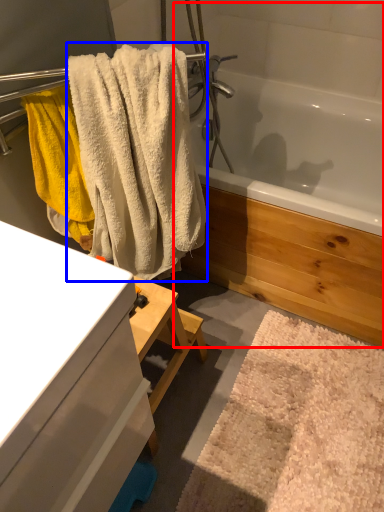
Question: Which of the following is the farthest to the observer, jacuzzi (highlighted by a red box) or towel (highlighted by a blue box)?

Choices:
 (A) jacuzzi
 (B) towel

Answer: (A)